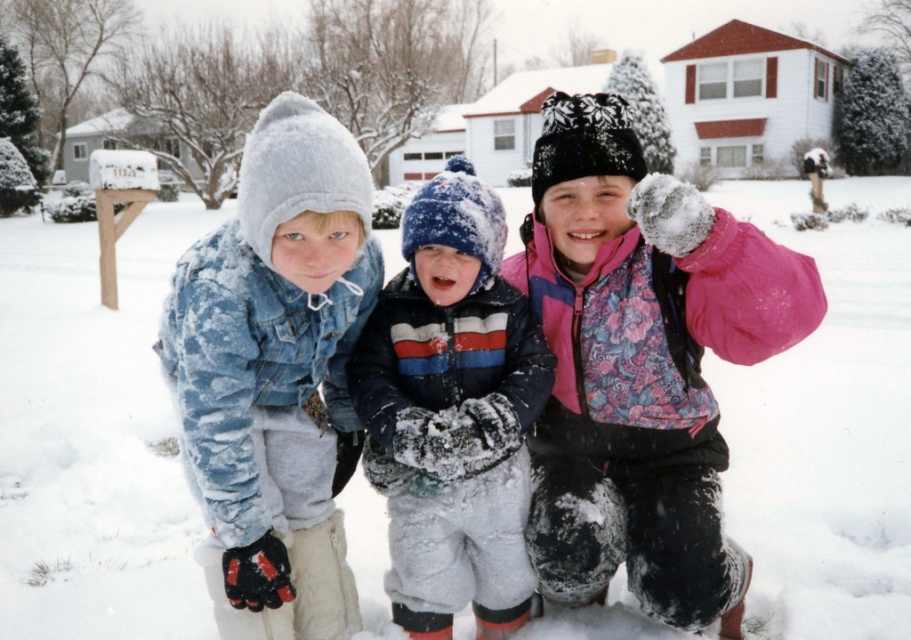
Question: Which point is farther from the camera taking this photo?

Choices:
 (A) (227, 557)
 (B) (505, 419)
 (C) (650, 342)

Answer: (C)

Question: Can you confirm if pink fleece jacket at center is positioned to the left of striped fleece jacket at center?

Choices:
 (A) no
 (B) yes

Answer: (A)

Question: Which is nearer to the fuzzy denim jacket at center?

Choices:
 (A) striped fleece jacket at center
 (B) pink fleece jacket at center

Answer: (A)

Question: Which point is closer to the camera?

Choices:
 (A) click(x=404, y=548)
 (B) click(x=648, y=422)

Answer: (A)

Question: Does pink fleece jacket at center have a smaller size compared to striped fleece jacket at center?

Choices:
 (A) no
 (B) yes

Answer: (A)

Question: Does fuzzy denim jacket at center have a greater width compared to striped fleece jacket at center?

Choices:
 (A) no
 (B) yes

Answer: (B)